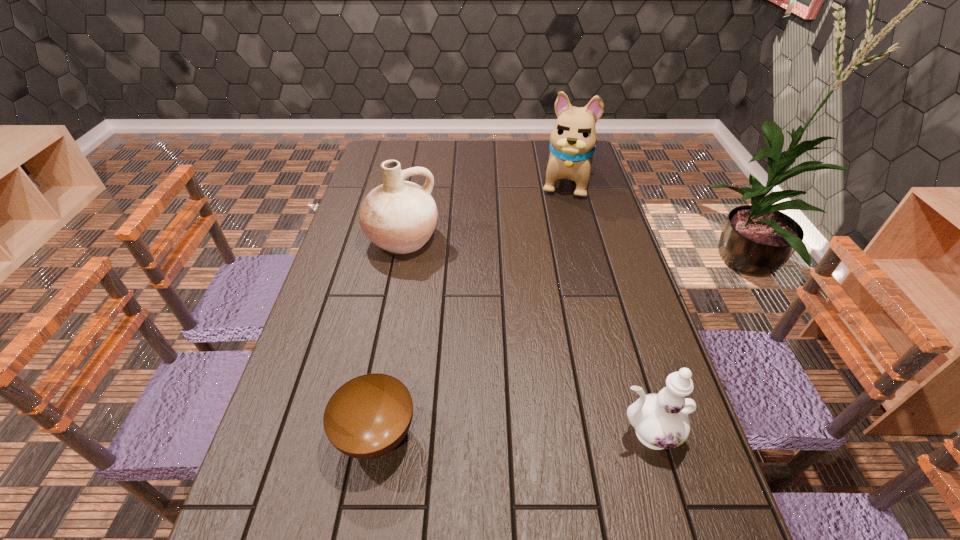
Locate an element on the screen. The width and height of the screenshot is (960, 540). vacant space on the desktop that is between the shortest object and the chinaware and is positioned to pour from the handle of the pottery is located at coordinates (492, 434).

Find the location of a particular element. This screenshot has width=960, height=540. free space on the desktop that is between the shortest object and the chinaware and is positioned on the face of the farthest object is located at coordinates (505, 434).